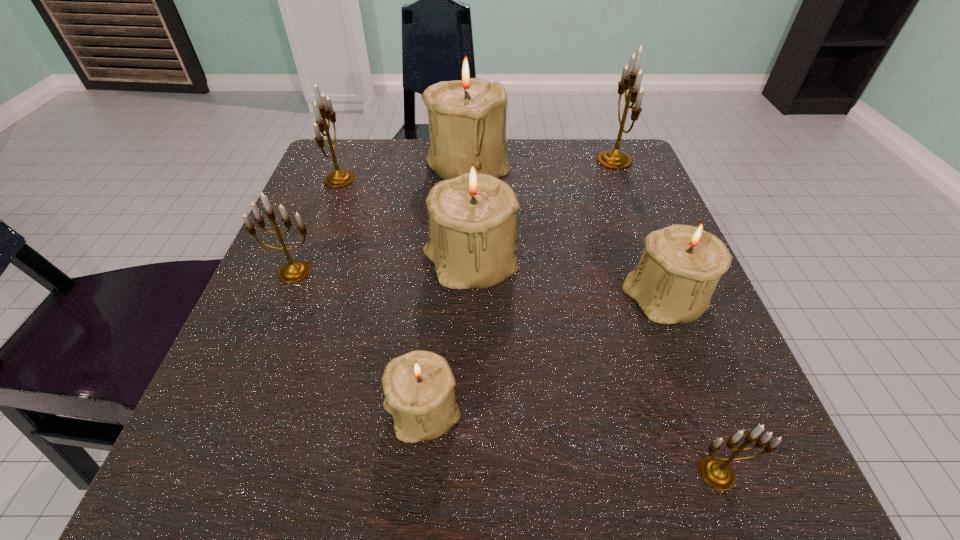
At what (x,y) coordinates should I click in order to perform the action: click on the farthest beige candle_holder. Please return your answer as a coordinate pair (x, y). The image size is (960, 540). Looking at the image, I should click on (468, 114).

Find the location of a particular element. This screenshot has height=540, width=960. the biggest gold candelabrum is located at coordinates (631, 78).

The height and width of the screenshot is (540, 960). Identify the location of the third smallest beige candle_holder. (472, 219).

This screenshot has width=960, height=540. Find the location of `the second biggest gold candelabrum`. the second biggest gold candelabrum is located at coordinates (339, 178).

The height and width of the screenshot is (540, 960). I want to click on the third biggest gold candelabrum, so click(293, 271).

Identify the location of the third biggest beige candle_holder. (680, 266).

Identify the location of the nearest beige candle_holder. Image resolution: width=960 pixels, height=540 pixels. (419, 386).

This screenshot has width=960, height=540. I want to click on the second nearest object, so click(x=419, y=386).

Where is `the smallest gold candelabrum`? This screenshot has height=540, width=960. the smallest gold candelabrum is located at coordinates (716, 472).

The height and width of the screenshot is (540, 960). Find the location of `the nearest candelabrum`. the nearest candelabrum is located at coordinates (716, 472).